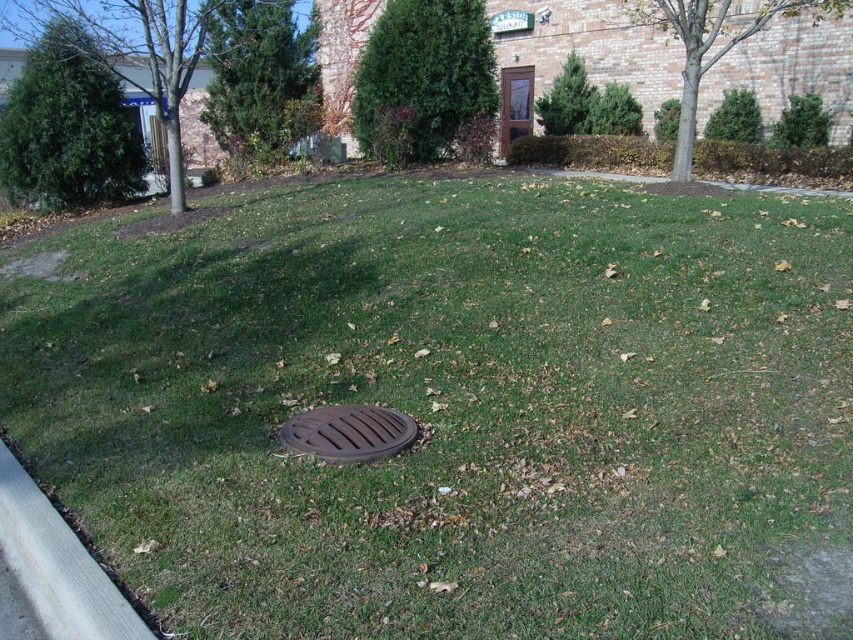
Question: Considering the relative positions of green grass at center and gray concrete curb at lower left in the image provided, where is green grass at center located with respect to gray concrete curb at lower left?

Choices:
 (A) below
 (B) above

Answer: (B)

Question: Among these objects, which one is farthest from the camera?

Choices:
 (A) gray concrete curb at lower left
 (B) brown matte manhole cover at center

Answer: (B)

Question: Among these points, which one is nearest to the camera?

Choices:
 (A) (292, 538)
 (B) (309, 410)
 (C) (78, 618)

Answer: (C)

Question: Does gray concrete curb at lower left come in front of brown matte manhole cover at center?

Choices:
 (A) yes
 (B) no

Answer: (A)

Question: Is green grass at center further to camera compared to gray concrete curb at lower left?

Choices:
 (A) no
 (B) yes

Answer: (A)

Question: Which object is closer to the camera taking this photo?

Choices:
 (A) gray concrete curb at lower left
 (B) brown matte manhole cover at center
 (C) green grass at center

Answer: (C)